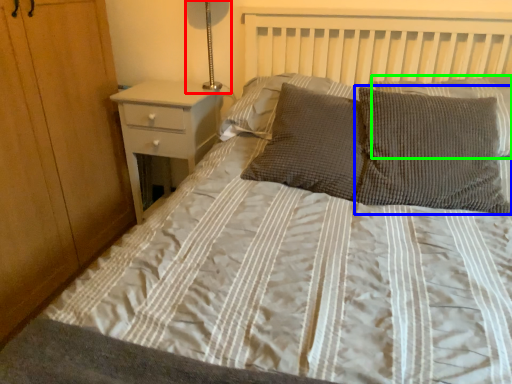
Question: Considering the real-world distances, which object is closest to bedside lamp (highlighted by a red box)? pillow (highlighted by a blue box) or pillow (highlighted by a green box).

Choices:
 (A) pillow
 (B) pillow

Answer: (B)